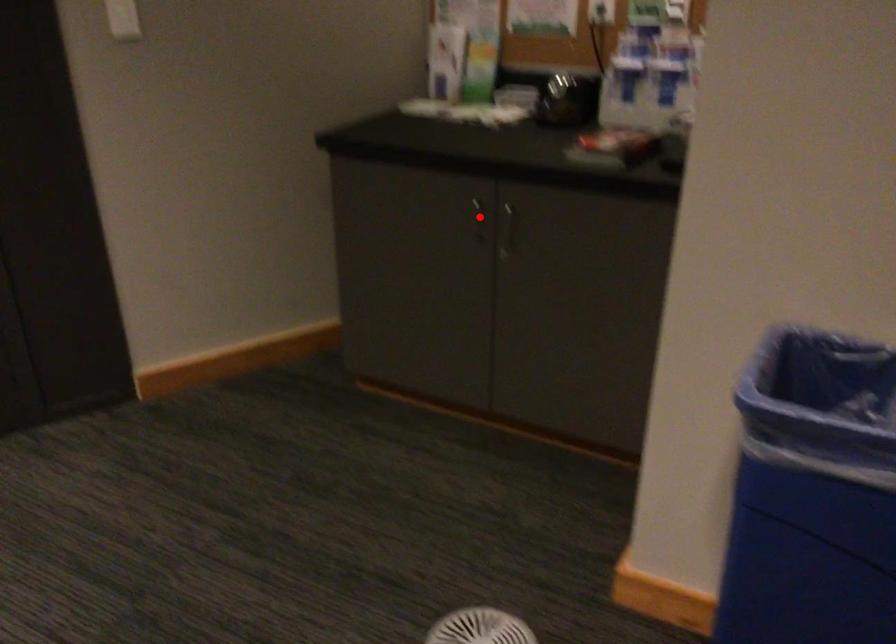
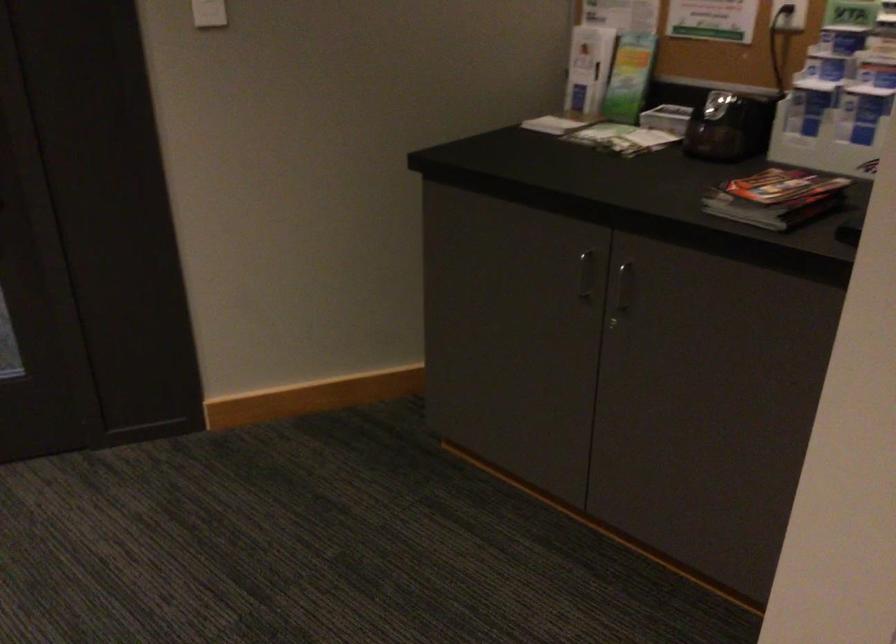
The point at the highlighted location is marked in the first image. Where is the corresponding point in the second image?

(584, 275)